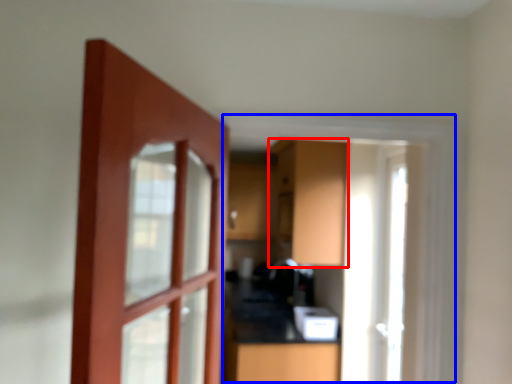
Question: Which object appears farthest to the camera in this image, cabinetry (highlighted by a red box) or window frame (highlighted by a blue box)?

Choices:
 (A) cabinetry
 (B) window frame

Answer: (A)